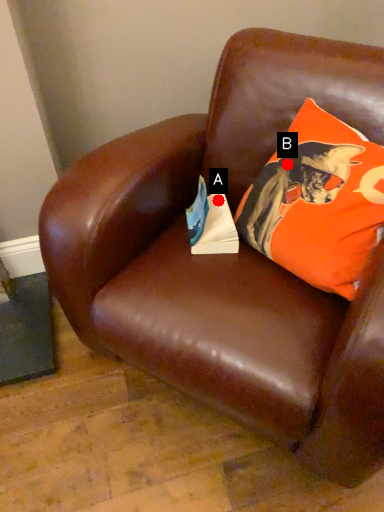
Question: Two points are circled on the image, labeled by A and B beside each circle. Which point is farther to the camera?

Choices:
 (A) A is further
 (B) B is further

Answer: (A)